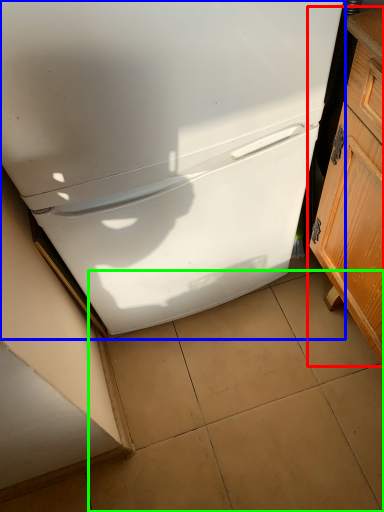
Question: Which object is the closest to the cabinetry (highlighted by a red box)? Choose among these: refrigerator (highlighted by a blue box) or tile (highlighted by a green box).

Choices:
 (A) refrigerator
 (B) tile

Answer: (A)